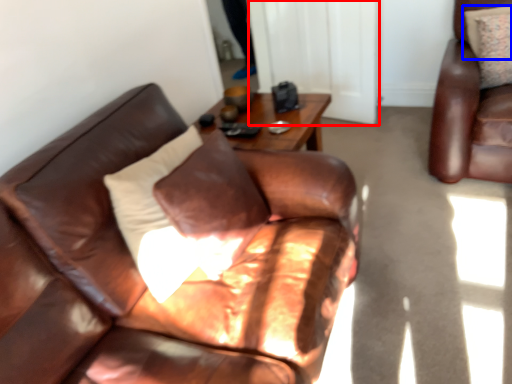
Question: Which object appears closest to the camera in this image, glass door (highlighted by a red box) or pillow (highlighted by a blue box)?

Choices:
 (A) glass door
 (B) pillow

Answer: (B)